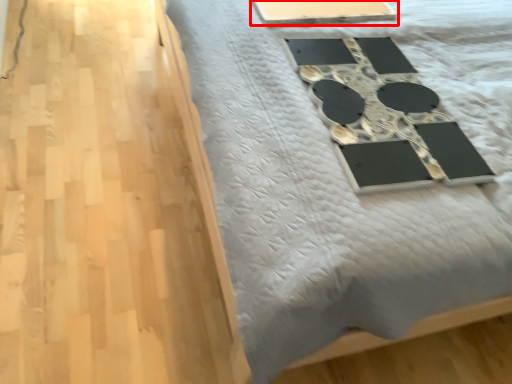
Question: From the image's perspective, where is table (annotated by the red box) located relative to furniture?

Choices:
 (A) below
 (B) above

Answer: (B)